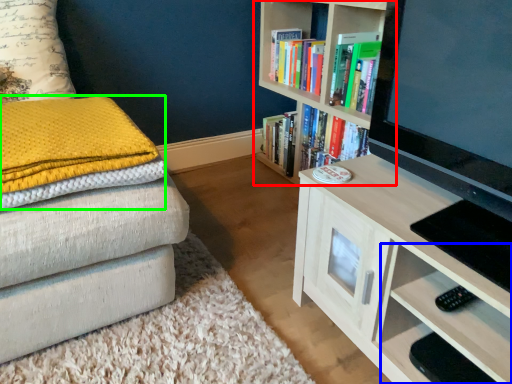
Question: Which object is positioned farthest from bookcase (highlighted by a red box)? Select from drawer (highlighted by a blue box) and blanket (highlighted by a green box).

Choices:
 (A) drawer
 (B) blanket

Answer: (B)